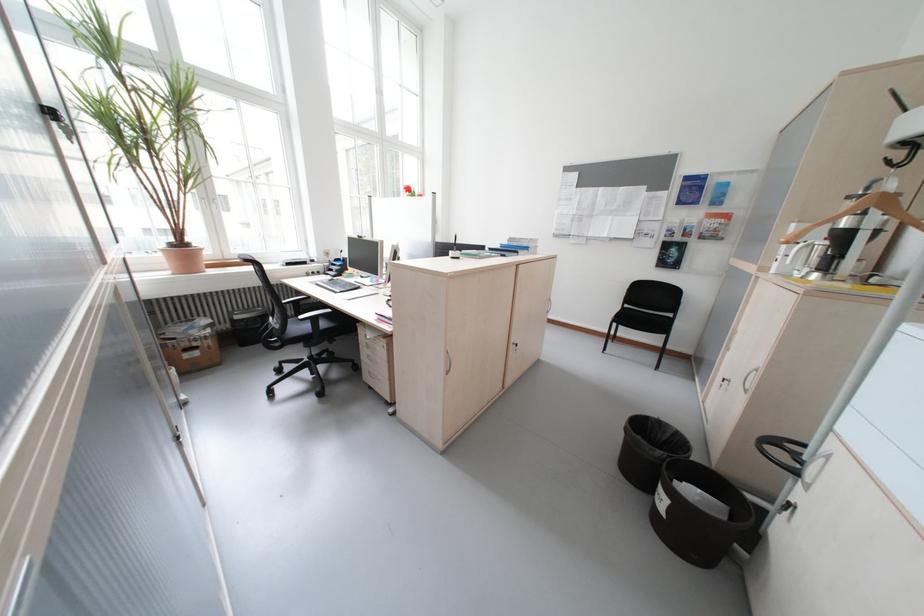
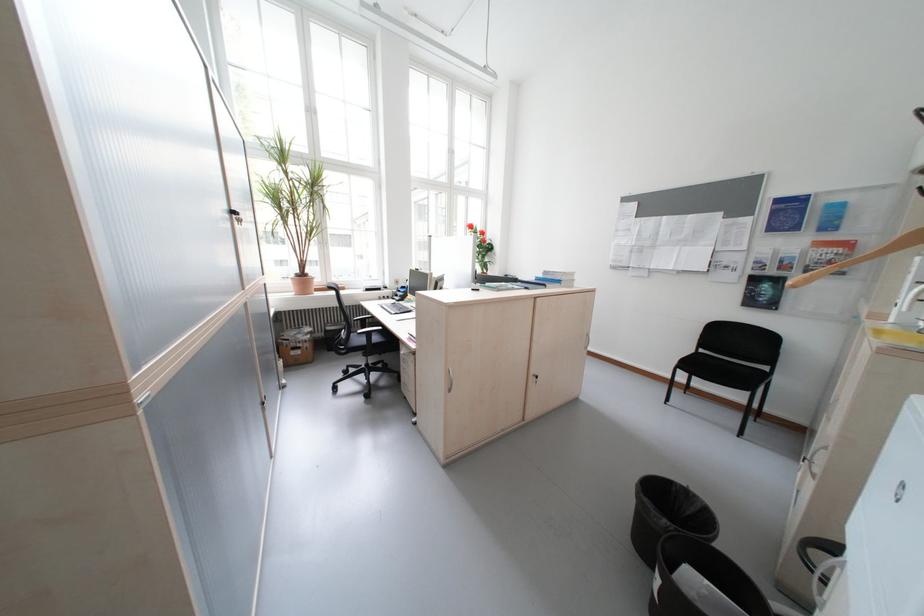
Question: I am providing you with two images of the same scene from different viewpoints. Please identify which objects are invisible in image2.

Choices:
 (A) cabinet door lock
 (B) black chair armrest
 (C) metal cabinet lock
 (D) none of these

Answer: (D)